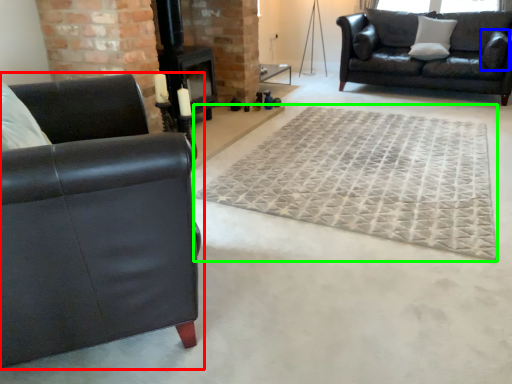
Question: Considering the real-world distances, which object is farthest from studio couch (highlighted by a red box)? pillow (highlighted by a blue box) or mat (highlighted by a green box)?

Choices:
 (A) pillow
 (B) mat

Answer: (A)